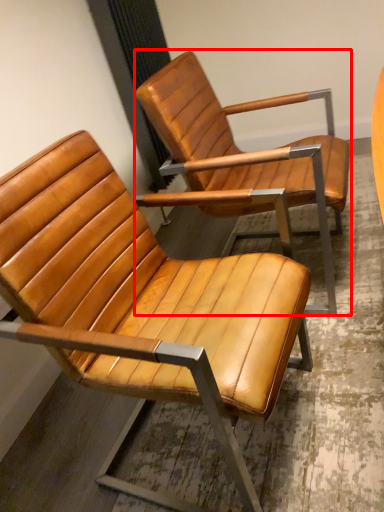
Question: From the image's perspective, what is the correct spatial positioning of chair (annotated by the red box) in reference to chair?

Choices:
 (A) above
 (B) below

Answer: (A)